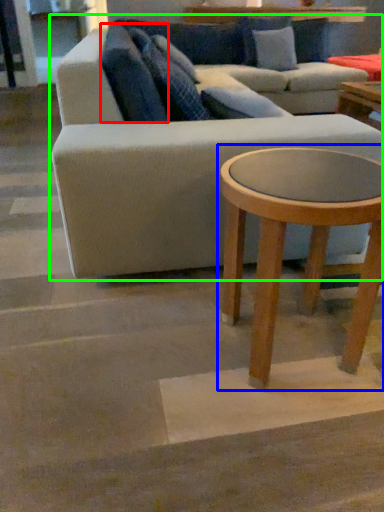
Question: Which object is positioned closest to pillow (highlighted by a red box)? Select from coffee table (highlighted by a blue box) and studio couch (highlighted by a green box).

Choices:
 (A) coffee table
 (B) studio couch

Answer: (B)